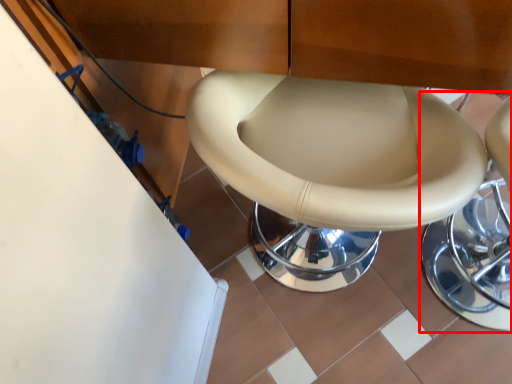
Question: From the image's perspective, considering the relative positions of bar stool (annotated by the red box) and toilet in the image provided, where is bar stool (annotated by the red box) located with respect to the staircase?

Choices:
 (A) above
 (B) below

Answer: (B)